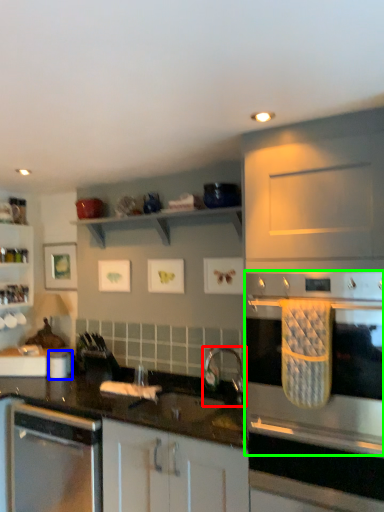
Question: Based on their relative distances, which object is farther from tap (highlighted by a red box)? Choose from appliance (highlighted by a blue box) and home appliance (highlighted by a green box).

Choices:
 (A) appliance
 (B) home appliance

Answer: (A)